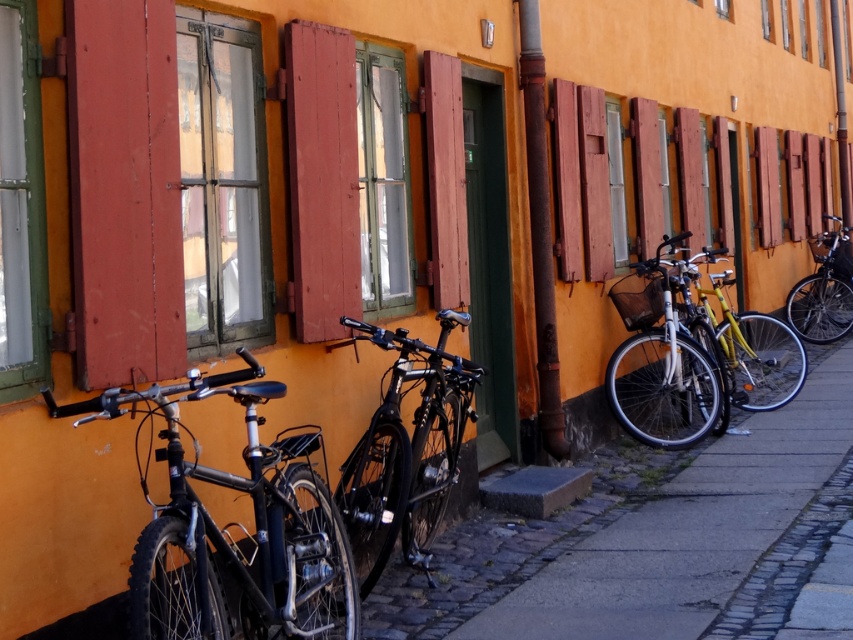
You are a delivery person trying to park your bicycle between the shiny black bicycle at center and the wooden shutter at center. According to the scene, can you fit your bicycle there?

The shiny black bicycle at center is to the right of the wooden shutter at center, so there is space between them where you can park your bicycle.

You are a delivery person trying to park your new bicycle next to the shiny black bicycle at center. The space available is exactly the width of the wooden shutter at center. Can your bicycle fit in that space?

The shiny black bicycle at center is wider than the wooden shutter at center. Since the available space is the width of the wooden shutter at center, your bicycle cannot fit in that space.

You are standing at the point with coordinates [660,362] in the street scene. What object is exactly at your current location?

The matte black bicycle at center is located at point [660,362].